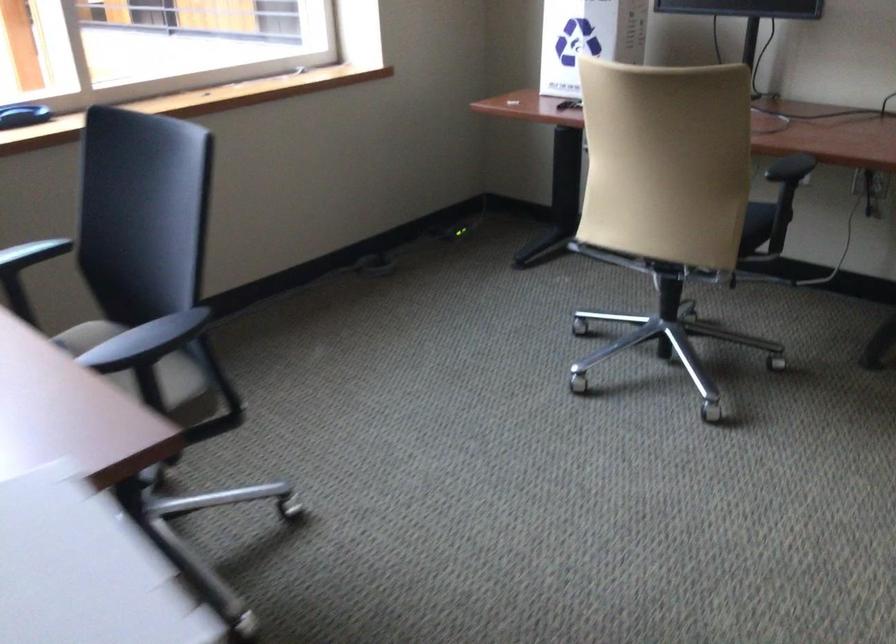
This screenshot has height=644, width=896. What do you see at coordinates (755, 225) in the screenshot?
I see `the beige chair sitting surface` at bounding box center [755, 225].